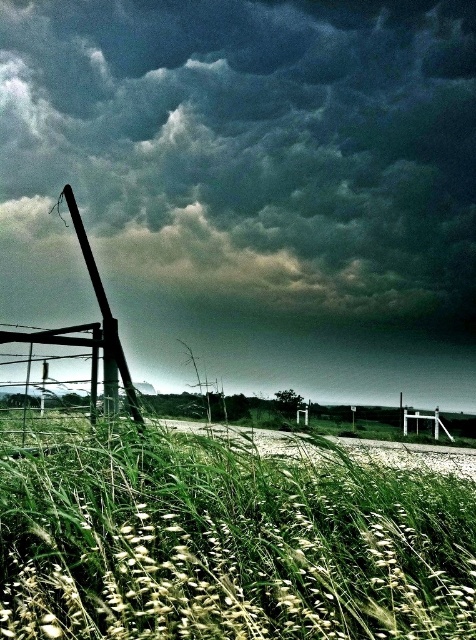
You are standing on the gravel road and looking towards the dark gray cloud at upper center. Can you see the metallic pole at left from this vantage point?

The metallic pole at left is behind the dark gray cloud at upper center, so it is obscured from your view when looking towards the cloud.

You are standing at the point closer to the camera in the image. Which point are you standing at, point (459, 557) or point (96, 292)?

You are standing at point (459, 557) because it is closer to the camera than point (96, 292).

You are a hiker standing at the point with coordinates (250, 186) in the image. Looking around, you notice a dark gray cloud. Where is this cloud located relative to your position?

The dark gray cloud at upper center is located above you at point (250, 186).